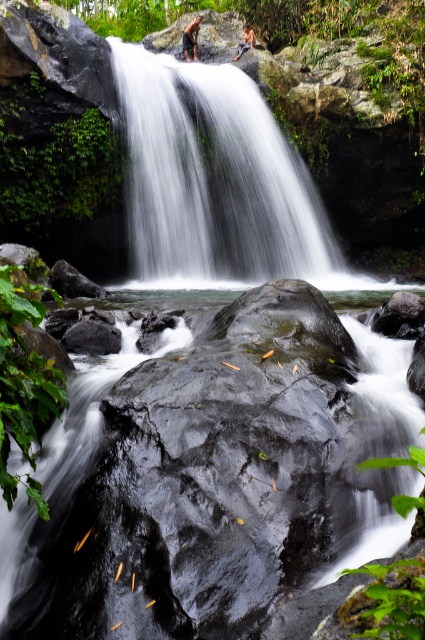
You are planning to place a small bench for visitors to rest near the glossy rock at center and the white smooth waterfall at center. Given that the bench requires 3 meters of space between the two objects to be placed safely, can the bench be positioned between them?

The glossy rock at center and white smooth waterfall at center are 5.29 meters apart, which is more than the required 3 meters of space. Therefore, the bench can be safely positioned between them.

You are a photographer standing at the base of the white smooth waterfall at center and want to take a photo of the brown furry bear at upper center. Which object is closer to your camera lens?

The white smooth waterfall at center is closer to the viewer than the brown furry bear at upper center, so the waterfall will appear closer to your camera lens.

In the scene shown: You are a photographer standing at the edge of a cliff overlooking the white smooth waterfall at center. You want to capture a closeup shot of the waterfall. Considering your camera can focus on objects up to 5 meters away, will you be able to take the photo without moving closer?

The white smooth waterfall at center is 7.03 meters away from the camera, which is beyond the camera focus range of 5 meters. Therefore, you cannot take a closeup shot without moving closer.